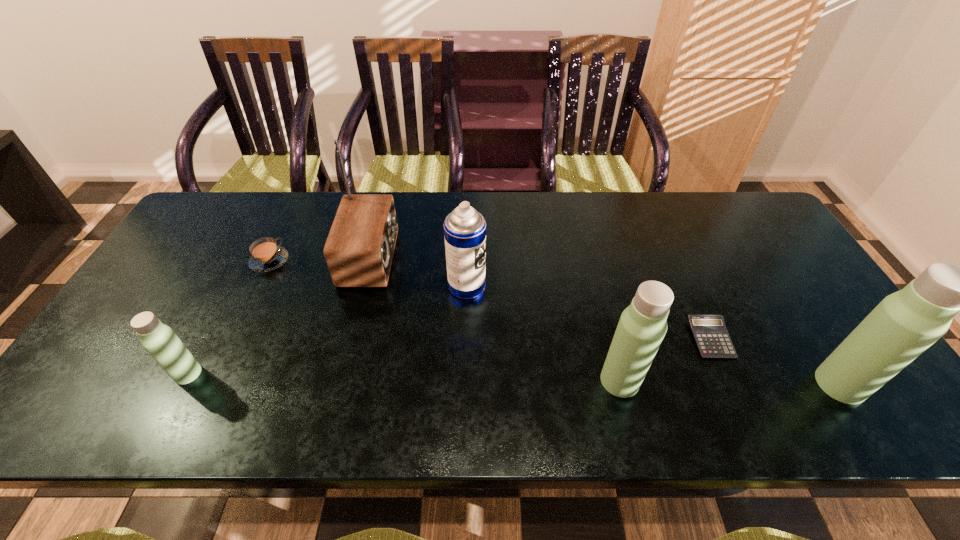
If we want them evenly spaced by inserting an extra thermos_bottle among them, please locate a free spot for this new thermos_bottle. Please provide its 2D coordinates. Your answer should be formatted as a tuple, i.e. [(x, y)], where the tuple contains the x and y coordinates of a point satisfying the conditions above.

[(402, 377)]